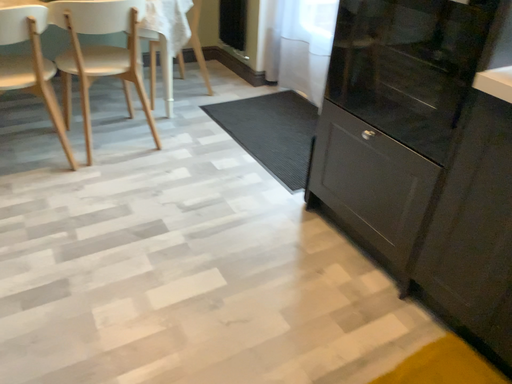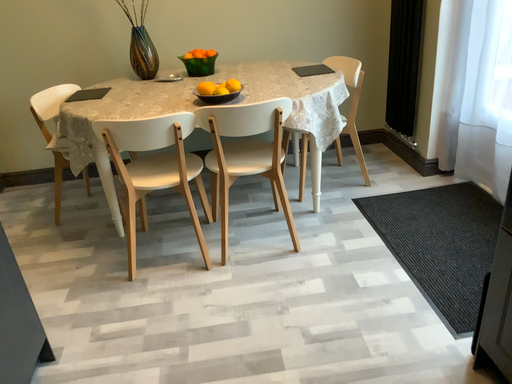
Question: Which way did the camera rotate in the video?

Choices:
 (A) rotated downward
 (B) rotated upward

Answer: (B)